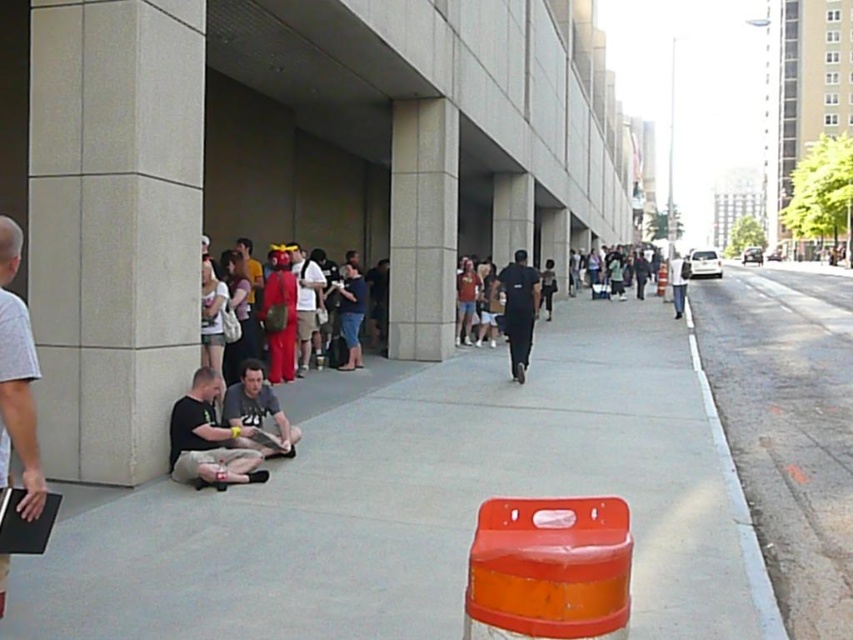
You are standing at the point marked as point (3, 472) in the image. You want to cross the street to reach the building entrance. The crosswalk is 4 meters away. Can you reach the crosswalk before the traffic light turns red?

The distance between you and the crosswalk is 3.55 meters, which is less than 4 meters. Therefore, you can reach the crosswalk before the traffic light turns red.

In the scene shown: You are a photographer standing on the sidewalk and want to take a photo that includes both the matte gray shirt at left and the dark blue shirt at center. Which shirt should you adjust your camera angle to focus on first to ensure both are in the frame?

The matte gray shirt at left is located below the dark blue shirt at center, so you should focus on the dark blue shirt at center first to ensure the matte gray shirt at left, which is lower, is still within the frame.

You are a photographer trying to capture a photo of the matte gray shirt at left and the red costume at center. Which one should you zoom in on to make them appear the same size in the photo?

The matte gray shirt at left is smaller in size compared to the red costume at center, so you should zoom in on the matte gray shirt at left to make them appear the same size in the photo.